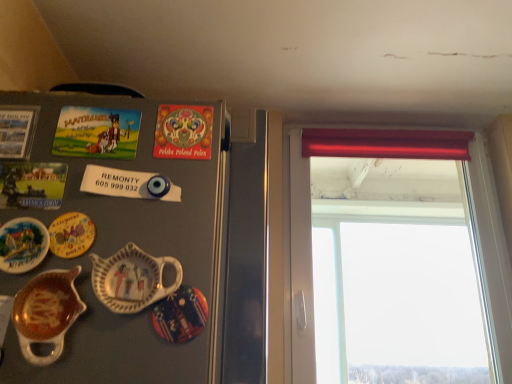
Question: Considering the relative sizes of matte ceramic gravy boat at lower left, the second tableware when ordered from right to left, and decorative ceramic pitcher at left, marked as the second tableware in a left-to-right arrangement, in the image provided, is matte ceramic gravy boat at lower left, the second tableware when ordered from right to left, wider than decorative ceramic pitcher at left, marked as the second tableware in a left-to-right arrangement,?

Choices:
 (A) no
 (B) yes

Answer: (B)

Question: Is matte ceramic gravy boat at lower left, which appears as the 1th tableware when viewed from the left, taller than decorative ceramic pitcher at left, marked as the second tableware in a left-to-right arrangement?

Choices:
 (A) yes
 (B) no

Answer: (A)

Question: From a real-world perspective, is matte ceramic gravy boat at lower left, the second tableware when ordered from right to left, under decorative ceramic pitcher at left, marked as the second tableware in a left-to-right arrangement?

Choices:
 (A) yes
 (B) no

Answer: (A)

Question: From a real-world perspective, is matte ceramic gravy boat at lower left, which appears as the 1th tableware when viewed from the left, physically above decorative ceramic pitcher at left, marked as the second tableware in a left-to-right arrangement?

Choices:
 (A) no
 (B) yes

Answer: (A)

Question: From the image's perspective, is matte ceramic gravy boat at lower left, which appears as the 1th tableware when viewed from the left, located beneath decorative ceramic pitcher at left, which is the 1th tableware in right-to-left order?

Choices:
 (A) yes
 (B) no

Answer: (A)

Question: In terms of height, does decorative ceramic pitcher at left, which is the 1th tableware in right-to-left order, look taller or shorter compared to matte ceramic plate at left, marked as the second plate in a left-to-right arrangement?

Choices:
 (A) tall
 (B) short

Answer: (A)

Question: In terms of width, does decorative ceramic pitcher at left, marked as the second tableware in a left-to-right arrangement, look wider or thinner when compared to matte ceramic plate at left, marked as the second plate in a left-to-right arrangement?

Choices:
 (A) thin
 (B) wide

Answer: (B)

Question: Does point (138, 292) appear closer or farther from the camera than point (86, 233)?

Choices:
 (A) farther
 (B) closer

Answer: (B)

Question: Choose the correct answer: Is decorative ceramic pitcher at left, marked as the second tableware in a left-to-right arrangement, inside matte ceramic plate at left, acting as the 2th plate starting from the right, or outside it?

Choices:
 (A) outside
 (B) inside

Answer: (A)

Question: Visually, is matte ceramic plate at left, acting as the 2th plate starting from the right, positioned to the left or to the right of matte ceramic gravy boat at lower left, the second tableware when ordered from right to left?

Choices:
 (A) left
 (B) right

Answer: (B)

Question: Do you think matte ceramic plate at left, marked as the second plate in a left-to-right arrangement, is within matte ceramic gravy boat at lower left, which appears as the 1th tableware when viewed from the left, or outside of it?

Choices:
 (A) inside
 (B) outside

Answer: (B)

Question: Considering the positions of matte ceramic plate at left, marked as the second plate in a left-to-right arrangement, and matte ceramic gravy boat at lower left, which appears as the 1th tableware when viewed from the left, in the image, is matte ceramic plate at left, marked as the second plate in a left-to-right arrangement, wider or thinner than matte ceramic gravy boat at lower left, which appears as the 1th tableware when viewed from the left,?

Choices:
 (A) thin
 (B) wide

Answer: (A)

Question: From a real-world perspective, is matte ceramic plate at left, acting as the 2th plate starting from the right, above or below matte ceramic gravy boat at lower left, which appears as the 1th tableware when viewed from the left?

Choices:
 (A) above
 (B) below

Answer: (A)

Question: Is smooth plastic window at right bigger or smaller than matte ceramic plate at left, acting as the 2th plate starting from the right?

Choices:
 (A) small
 (B) big

Answer: (B)

Question: In the image, is smooth plastic window at right on the left side or the right side of matte ceramic plate at left, acting as the 2th plate starting from the right?

Choices:
 (A) left
 (B) right

Answer: (B)